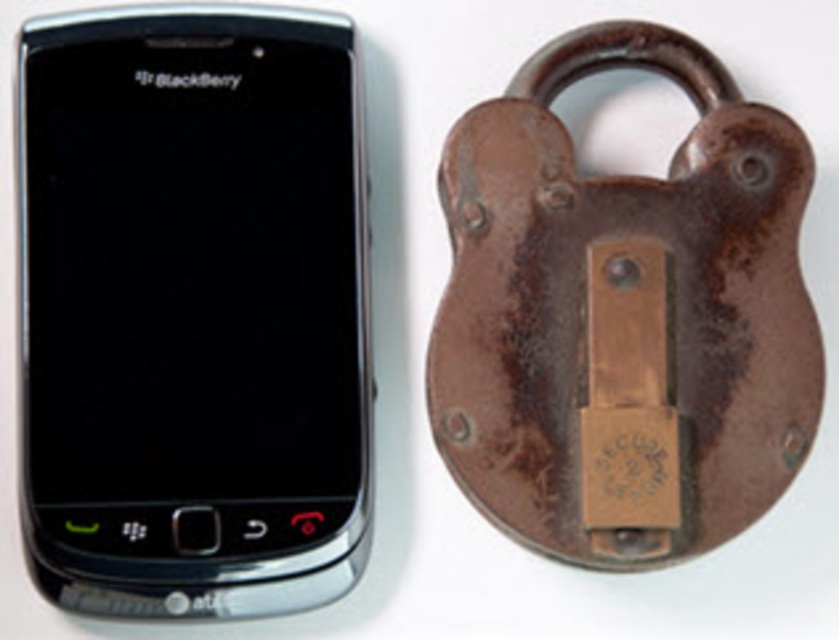
Question: Does black glossy smartphone at left have a greater width compared to rusty metal padlock at right?

Choices:
 (A) yes
 (B) no

Answer: (B)

Question: From the image, what is the correct spatial relationship of black glossy smartphone at left in relation to rusty metal padlock at right?

Choices:
 (A) right
 (B) left

Answer: (B)

Question: Which object appears farthest from the camera in this image?

Choices:
 (A) black glossy smartphone at left
 (B) rusty metal padlock at right

Answer: (B)

Question: Observing the image, what is the correct spatial positioning of black glossy smartphone at left in reference to rusty metal padlock at right?

Choices:
 (A) above
 (B) below

Answer: (B)